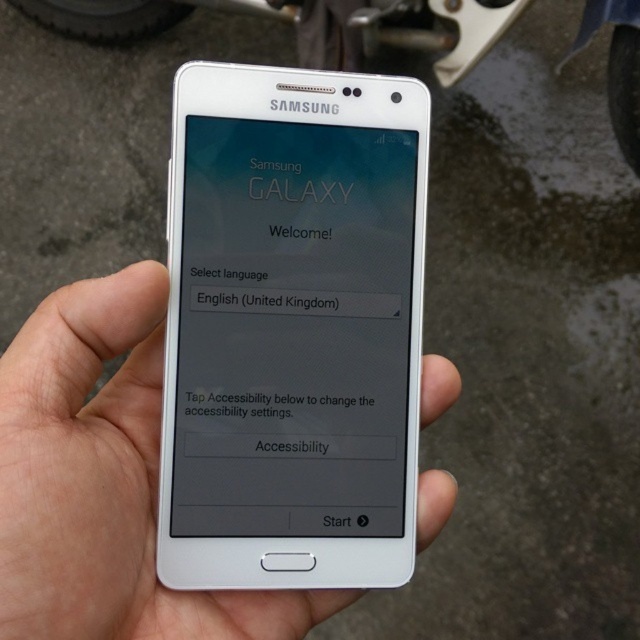
From the picture: You are looking at the Samsung Galaxy smartphone in the image. There are two points marked on the phone screen. The first point is at coordinates point (200, 323) and the second is at point (333, 40). Which of these points is nearer to you, the observer?

Point (200, 323) is closer to the camera than point (333, 40), so the first point is nearer to you.

You are trying to determine the relative sizes of objects in the image. Which object is taller between the white matte phone at center and the metallic silver motorbike at upper center?

The metallic silver motorbike at upper center is taller than the white matte phone at center.